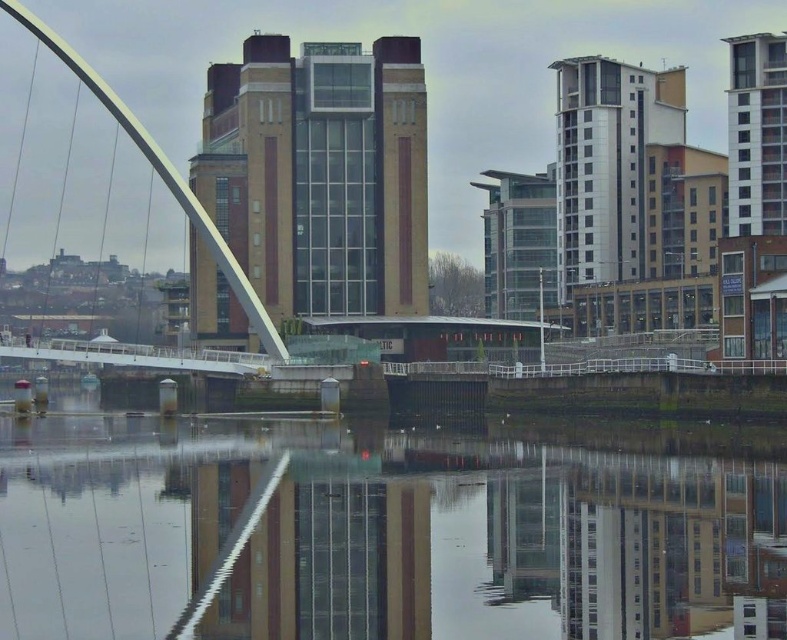
Between transparent glass water at center and white glossy arch bridge at left, which one has more height?

white glossy arch bridge at left

Does transparent glass water at center have a lesser width compared to white glossy arch bridge at left?

No, transparent glass water at center is not thinner than white glossy arch bridge at left.

Does point (708, 460) come farther from viewer compared to point (76, 68)?

No, (708, 460) is in front of (76, 68).

Identify the location of transparent glass water at center. (383, 538).